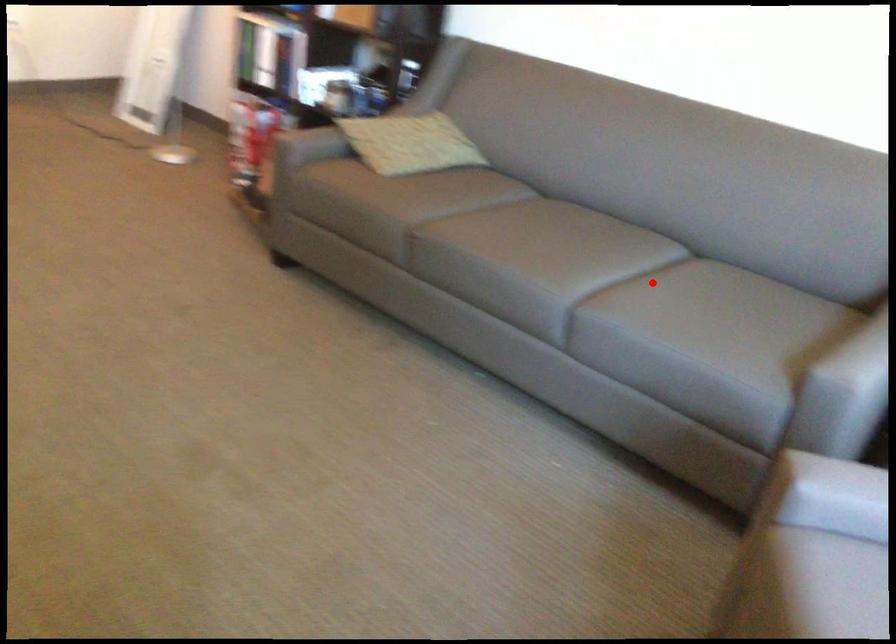
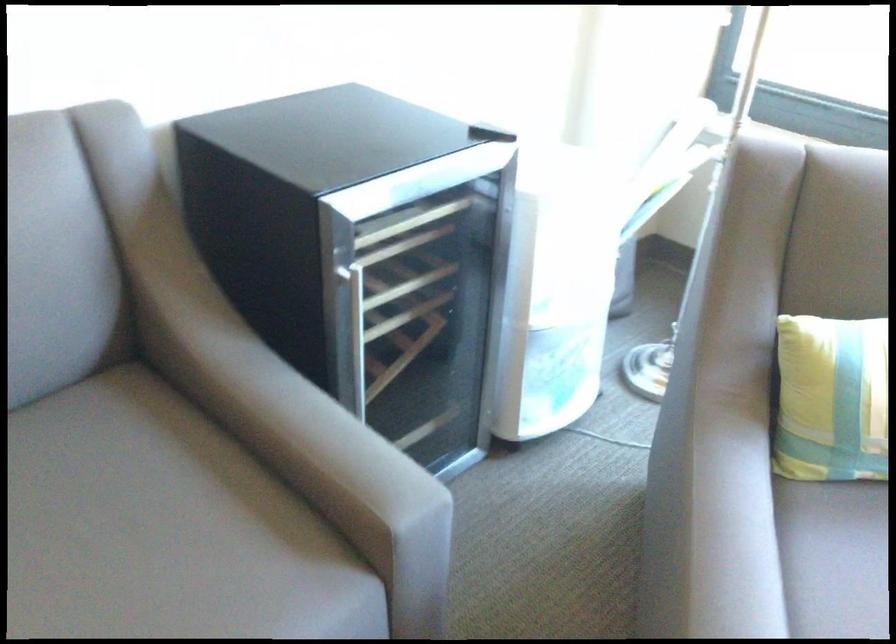
Question: I am providing you with two images of the same scene from different viewpoints. In image1, a red point is highlighted. Considering the same 3D point in image2, which of the following is correct?

Choices:
 (A) It is closer
 (B) It is farther

Answer: (A)